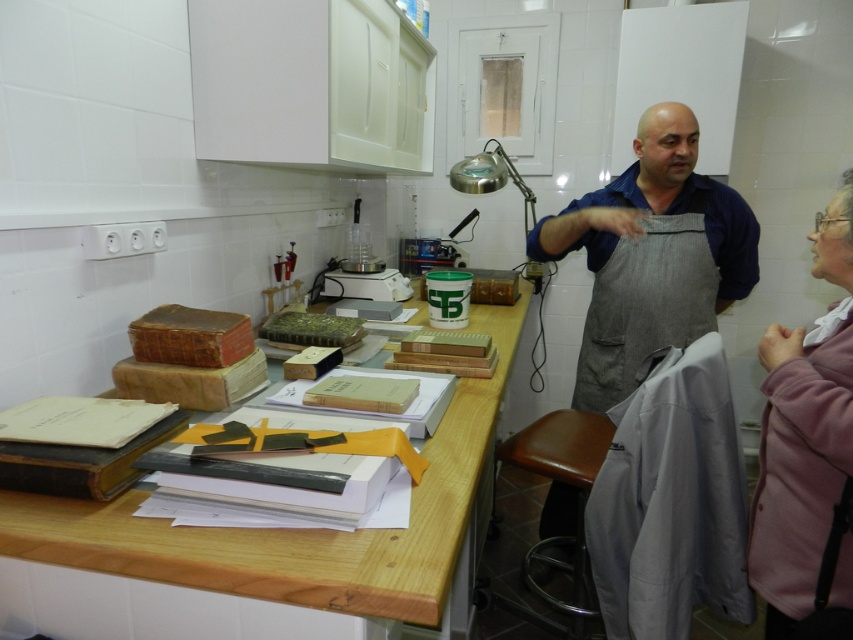
Question: Which of these objects is positioned farthest from the wooden table at center?

Choices:
 (A) gray cotton apron at center
 (B) pink fabric jacket at lower right
 (C) brown leather stool at lower center

Answer: (C)

Question: Does wooden table at center lie in front of gray cotton apron at center?

Choices:
 (A) no
 (B) yes

Answer: (B)

Question: Which object is closer to the camera taking this photo?

Choices:
 (A) gray cotton apron at center
 (B) brown leather stool at lower center
 (C) pink fabric jacket at lower right
 (D) wooden table at center

Answer: (D)

Question: Is gray cotton apron at center behind brown leather stool at lower center?

Choices:
 (A) yes
 (B) no

Answer: (A)

Question: Which object appears closest to the camera in this image?

Choices:
 (A) gray cotton apron at center
 (B) wooden table at center
 (C) brown leather stool at lower center

Answer: (B)

Question: Considering the relative positions of gray cotton apron at center and brown leather stool at lower center in the image provided, where is gray cotton apron at center located with respect to brown leather stool at lower center?

Choices:
 (A) left
 (B) right

Answer: (B)